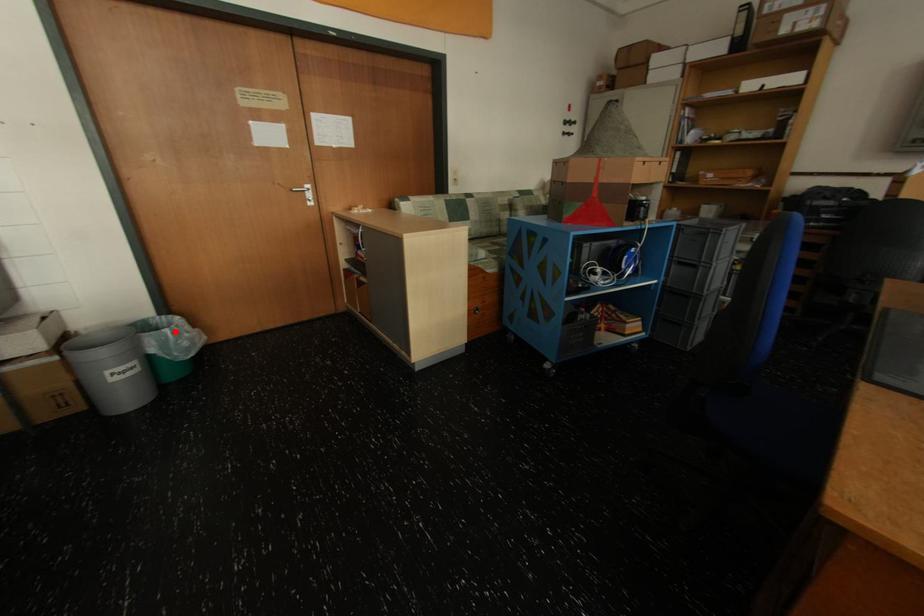
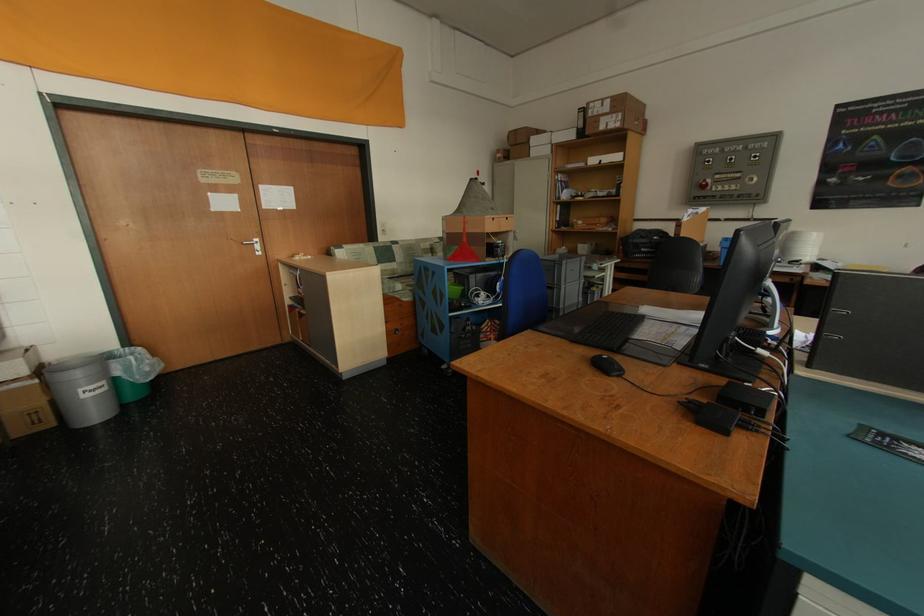
Question: I am providing you with two images of the same scene from different viewpoints. A red point is marked on the first image. Can you still see the location of the red point in image 2?

Choices:
 (A) Yes
 (B) No

Answer: (A)